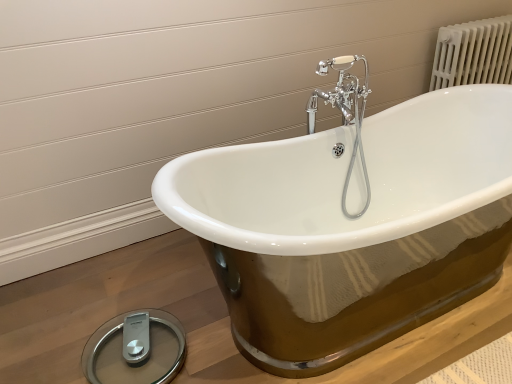
Question: Can chrome/metallic faucet at upper center be found inside white porcelain bathtub at center?

Choices:
 (A) yes
 (B) no

Answer: (B)

Question: Is white porcelain bathtub at center touching chrome/metallic faucet at upper center?

Choices:
 (A) yes
 (B) no

Answer: (B)

Question: Can you confirm if white porcelain bathtub at center is bigger than chrome/metallic faucet at upper center?

Choices:
 (A) yes
 (B) no

Answer: (A)

Question: From a real-world perspective, does white porcelain bathtub at center sit lower than chrome/metallic faucet at upper center?

Choices:
 (A) no
 (B) yes

Answer: (B)

Question: Does white porcelain bathtub at center lie in front of chrome/metallic faucet at upper center?

Choices:
 (A) yes
 (B) no

Answer: (A)

Question: From the image's perspective, is chrome/metallic faucet at upper center located above or below silver/glass scale at lower left?

Choices:
 (A) below
 (B) above

Answer: (B)

Question: Is chrome/metallic faucet at upper center in front of or behind silver/glass scale at lower left in the image?

Choices:
 (A) front
 (B) behind

Answer: (B)

Question: Does point (347, 76) appear closer or farther from the camera than point (173, 339)?

Choices:
 (A) closer
 (B) farther

Answer: (B)

Question: In terms of width, does chrome/metallic faucet at upper center look wider or thinner when compared to silver/glass scale at lower left?

Choices:
 (A) wide
 (B) thin

Answer: (B)

Question: Is silver/glass scale at lower left inside or outside of chrome/metallic faucet at upper center?

Choices:
 (A) outside
 (B) inside

Answer: (A)

Question: Based on their positions, is silver/glass scale at lower left located to the left or right of chrome/metallic faucet at upper center?

Choices:
 (A) left
 (B) right

Answer: (A)

Question: Is point (138, 347) closer or farther from the camera than point (338, 74)?

Choices:
 (A) closer
 (B) farther

Answer: (A)

Question: In terms of width, does silver/glass scale at lower left look wider or thinner when compared to chrome/metallic faucet at upper center?

Choices:
 (A) thin
 (B) wide

Answer: (B)

Question: From their relative heights in the image, would you say silver/glass scale at lower left is taller or shorter than white porcelain bathtub at center?

Choices:
 (A) tall
 (B) short

Answer: (A)

Question: From a real-world perspective, is silver/glass scale at lower left positioned above or below white porcelain bathtub at center?

Choices:
 (A) below
 (B) above

Answer: (B)